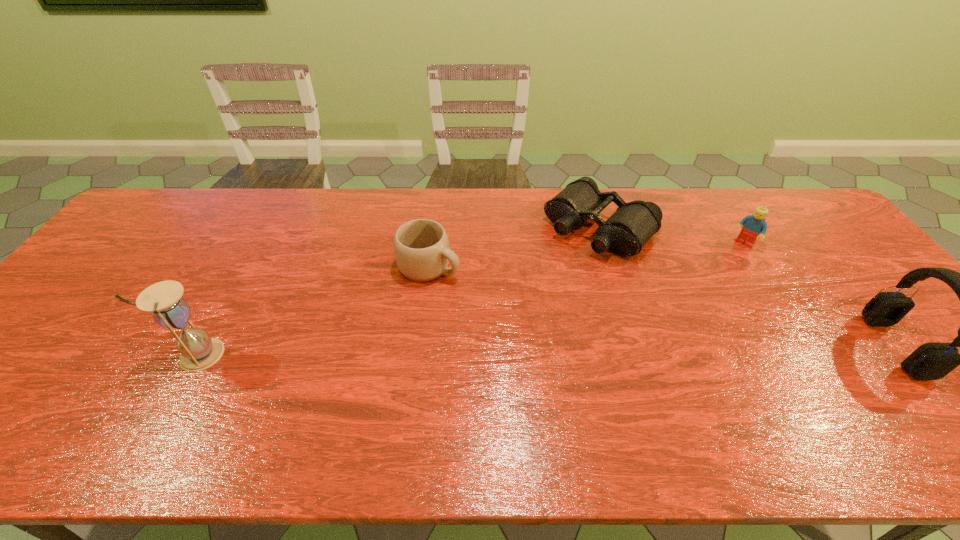
What are the coordinates of `free space between the third object from right to left and the Lego` in the screenshot? It's located at (671, 235).

The image size is (960, 540). What are the coordinates of `free spot between the second object from right to left and the mug` in the screenshot? It's located at (586, 255).

Locate an element on the screen. free space between the hourglass and the rightmost object is located at coordinates (547, 350).

I want to click on empty location between the mug and the leftmost object, so click(x=314, y=310).

I want to click on unoccupied position between the rightmost object and the fourth object from right to left, so click(662, 306).

I want to click on free space between the hourglass and the fourth object from left to right, so click(x=470, y=299).

Where is `vacant area that lies between the hourglass and the Lego`? Image resolution: width=960 pixels, height=540 pixels. vacant area that lies between the hourglass and the Lego is located at coordinates (470, 299).

Where is `the second closest object to the headset`? Image resolution: width=960 pixels, height=540 pixels. the second closest object to the headset is located at coordinates (625, 232).

This screenshot has width=960, height=540. Identify the location of object that stands as the second closest to the headset. (625, 232).

The height and width of the screenshot is (540, 960). Identify the location of free space that satisfies the following two spatial constraints: 1. on the back side of the second object from right to left; 2. on the left side of the hourglass. (258, 244).